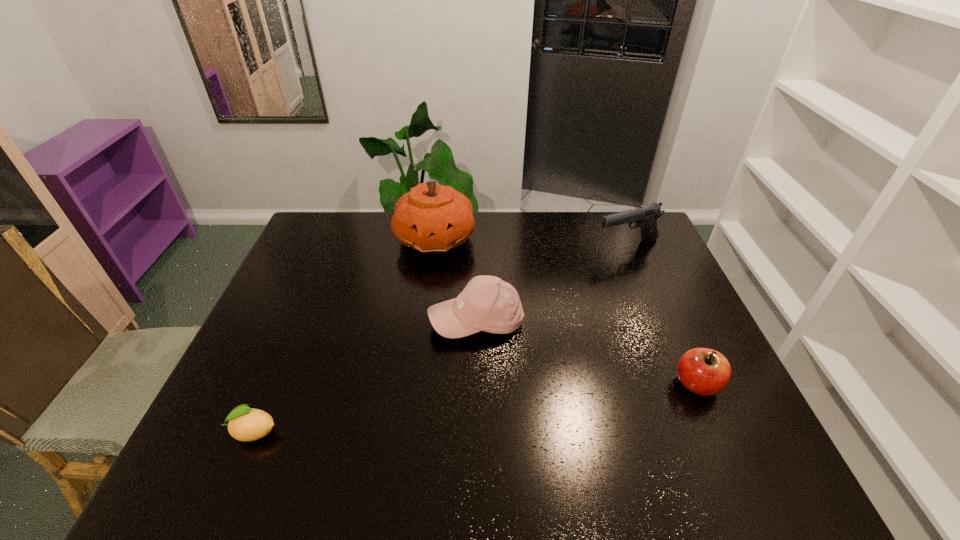
Find the location of a particular element. Image resolution: width=960 pixels, height=540 pixels. vacant area situated on the front-facing side of the third farthest object is located at coordinates (436, 395).

Find the location of a particular element. This screenshot has width=960, height=540. vacant area situated on the front-facing side of the third farthest object is located at coordinates (421, 427).

Where is `free location located 0.210m at the muzzle of the gun`? Image resolution: width=960 pixels, height=540 pixels. free location located 0.210m at the muzzle of the gun is located at coordinates (590, 292).

Where is `vacant space located at the muzzle of the gun`? vacant space located at the muzzle of the gun is located at coordinates (601, 275).

Where is `blank space located 0.050m at the muzzle of the gun`? blank space located 0.050m at the muzzle of the gun is located at coordinates (608, 264).

The image size is (960, 540). I want to click on free space located 0.200m on the front-facing side of the pumpkin, so click(x=469, y=300).

The image size is (960, 540). In order to click on free space located 0.220m on the front-facing side of the pumpkin in this screenshot , I will do `click(471, 305)`.

Locate an element on the screen. This screenshot has width=960, height=540. vacant space located on the front-facing side of the pumpkin is located at coordinates (461, 286).

This screenshot has width=960, height=540. Find the location of `gun positioned at the far edge`. gun positioned at the far edge is located at coordinates (645, 217).

Find the location of a particular element. This screenshot has height=540, width=960. pumpkin positioned at the far edge is located at coordinates (431, 218).